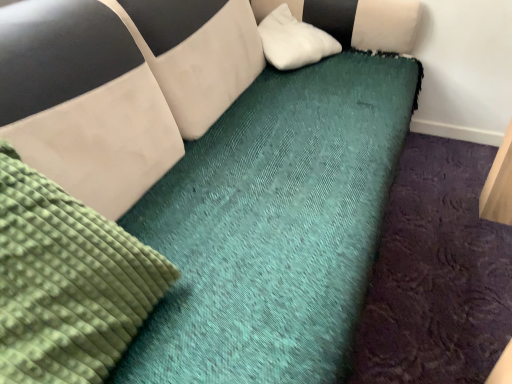
Question: From the image's perspective, is white soft pillow at upper center located above or below green textured mattress at upper left?

Choices:
 (A) below
 (B) above

Answer: (B)

Question: Is point (295, 34) positioned closer to the camera than point (25, 269)?

Choices:
 (A) closer
 (B) farther

Answer: (B)

Question: Is white soft pillow at upper center taller or shorter than green textured mattress at upper left?

Choices:
 (A) tall
 (B) short

Answer: (B)

Question: Considering their positions, is green textured mattress at upper left located in front of or behind white soft pillow at upper center?

Choices:
 (A) front
 (B) behind

Answer: (A)

Question: From the image's perspective, is green textured mattress at upper left above or below white soft pillow at upper center?

Choices:
 (A) above
 (B) below

Answer: (B)

Question: Is green textured mattress at upper left wider or thinner than white soft pillow at upper center?

Choices:
 (A) thin
 (B) wide

Answer: (A)

Question: Based on their sizes in the image, would you say green textured mattress at upper left is bigger or smaller than white soft pillow at upper center?

Choices:
 (A) small
 (B) big

Answer: (B)